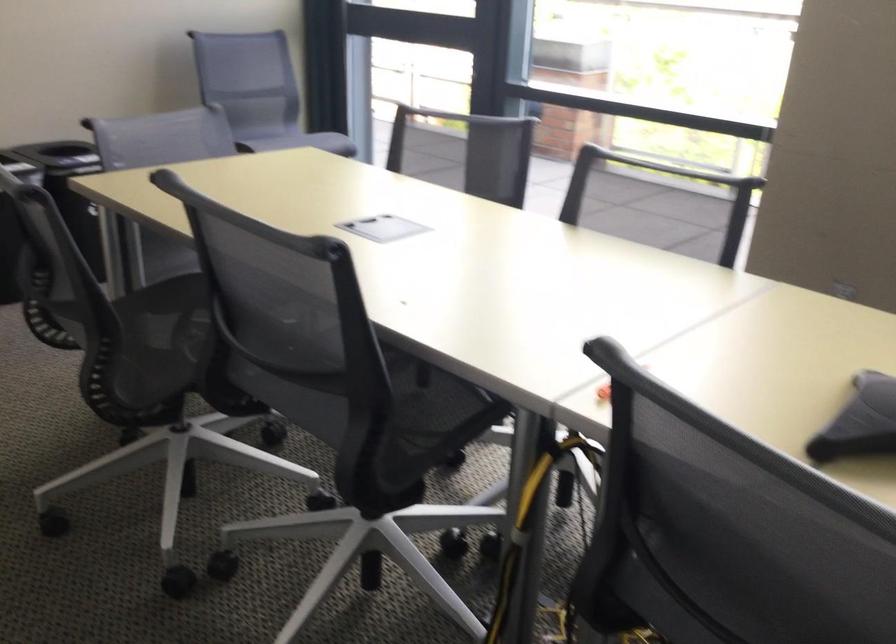
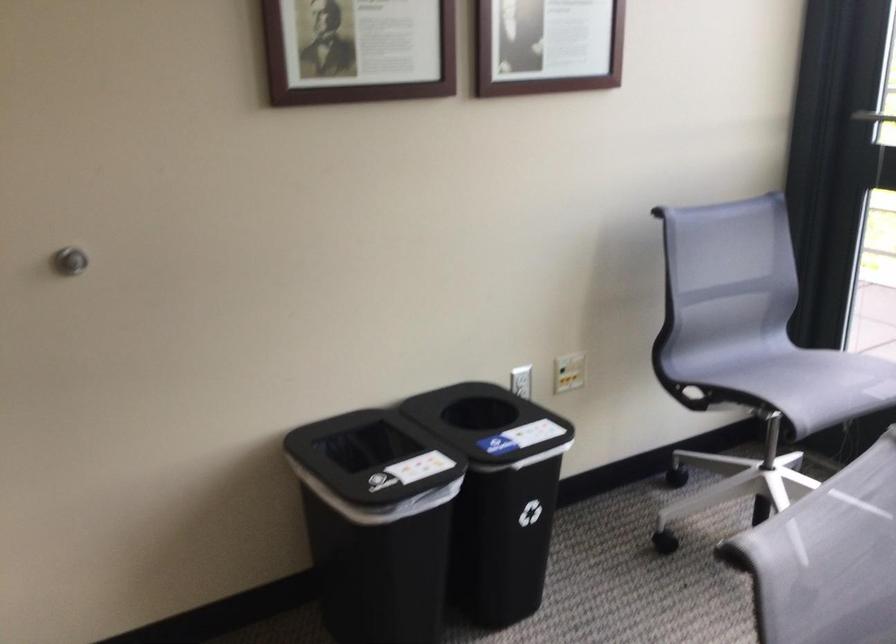
In a continuous first-person perspective shot, in which direction is the camera moving?

The cameraman moved toward left, forward.